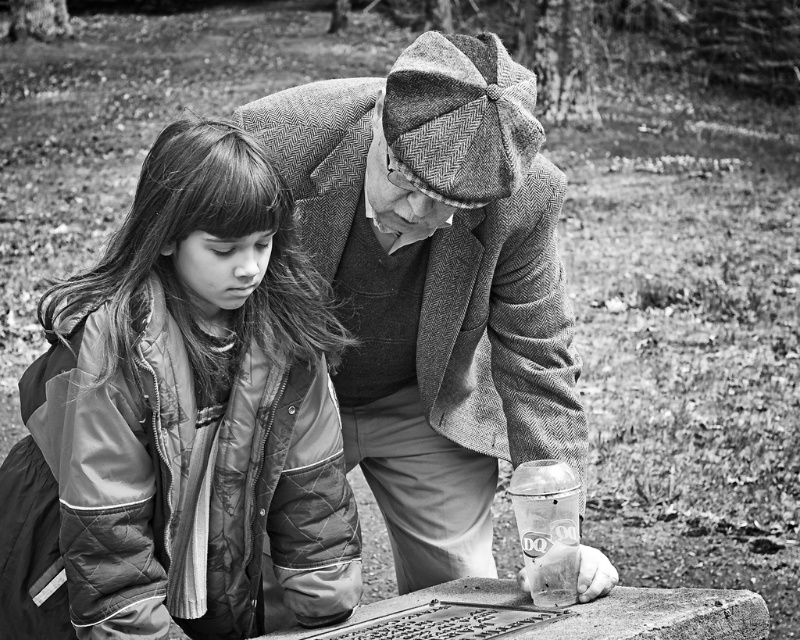
Question: Does quilted nylon jacket at center appear under woolen coat at center?

Choices:
 (A) yes
 (B) no

Answer: (A)

Question: Does quilted nylon jacket at center appear on the left side of woolen coat at center?

Choices:
 (A) no
 (B) yes

Answer: (B)

Question: Which point is closer to the camera taking this photo?

Choices:
 (A) (540, 356)
 (B) (44, 436)

Answer: (B)

Question: Is quilted nylon jacket at center wider than woolen coat at center?

Choices:
 (A) no
 (B) yes

Answer: (A)